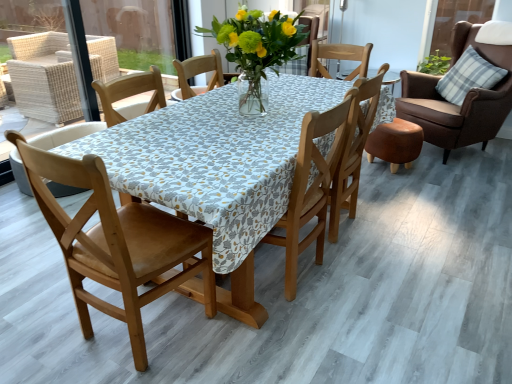
Question: Does brown leather chair at upper right, marked as the 1th chair in a right-to-left arrangement, have a larger size compared to plaid fabric pillow at upper right?

Choices:
 (A) yes
 (B) no

Answer: (A)

Question: Is plaid fabric pillow at upper right located within brown leather chair at upper right, marked as the 1th chair in a right-to-left arrangement?

Choices:
 (A) yes
 (B) no

Answer: (A)

Question: Is brown leather chair at upper right, positioned as the 5th chair in left-to-right order, thinner than plaid fabric pillow at upper right?

Choices:
 (A) yes
 (B) no

Answer: (B)

Question: Is brown leather chair at upper right, positioned as the 5th chair in left-to-right order, closer to camera compared to plaid fabric pillow at upper right?

Choices:
 (A) no
 (B) yes

Answer: (B)

Question: Could you tell me if brown leather chair at upper right, marked as the 1th chair in a right-to-left arrangement, is turned towards plaid fabric pillow at upper right?

Choices:
 (A) no
 (B) yes

Answer: (B)

Question: Relative to wooden chair at center, marked as the fourth chair in a left-to-right arrangement, is wooden chair at center, acting as the 2th chair starting from the left, in front or behind?

Choices:
 (A) front
 (B) behind

Answer: (A)

Question: Is wooden chair at center, acting as the 2th chair starting from the left, to the left or to the right of wooden chair at center, marked as the fourth chair in a left-to-right arrangement, in the image?

Choices:
 (A) left
 (B) right

Answer: (A)

Question: From a real-world perspective, is wooden chair at center, which appears as the fourth chair when viewed from the right, physically located above or below wooden chair at center, marked as the fourth chair in a left-to-right arrangement?

Choices:
 (A) below
 (B) above

Answer: (B)

Question: Is wooden chair at center, acting as the 2th chair starting from the left, spatially inside wooden chair at center, arranged as the 2th chair when viewed from the right, or outside of it?

Choices:
 (A) outside
 (B) inside

Answer: (A)

Question: Considering the positions of point (345, 195) and point (501, 89), is point (345, 195) closer or farther from the camera than point (501, 89)?

Choices:
 (A) closer
 (B) farther

Answer: (A)

Question: Looking at their shapes, would you say wooden chair at center, marked as the fourth chair in a left-to-right arrangement, is wider or thinner than brown leather chair at upper right, marked as the 1th chair in a right-to-left arrangement?

Choices:
 (A) wide
 (B) thin

Answer: (B)

Question: From the image's perspective, is wooden chair at center, arranged as the 2th chair when viewed from the right, positioned above or below brown leather chair at upper right, positioned as the 5th chair in left-to-right order?

Choices:
 (A) above
 (B) below

Answer: (B)

Question: Considering their positions, is wooden chair at center, arranged as the 2th chair when viewed from the right, located in front of or behind brown leather chair at upper right, positioned as the 5th chair in left-to-right order?

Choices:
 (A) behind
 (B) front

Answer: (B)

Question: From a real-world perspective, relative to brown leather chair at upper right, marked as the 1th chair in a right-to-left arrangement, is wooden chair at center, placed as the third chair when sorted from right to left, vertically above or below?

Choices:
 (A) below
 (B) above

Answer: (A)

Question: Based on their sizes in the image, would you say wooden chair at center, placed as the third chair when sorted from right to left, is bigger or smaller than brown leather chair at upper right, marked as the 1th chair in a right-to-left arrangement?

Choices:
 (A) big
 (B) small

Answer: (B)